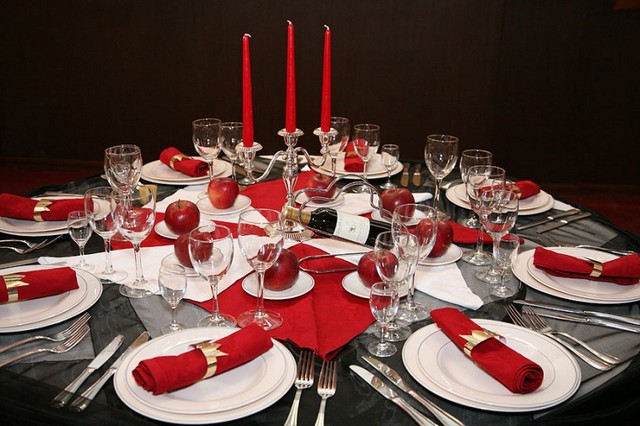
You are a GUI agent. You are given a task and a screenshot of the screen. Output one action in this format:
    pyautogui.click(x=<x>, y=<y>)
    Task: Click on the rolled napkins
    This screenshot has width=640, height=426.
    Given the screenshot: What is the action you would take?
    [x=226, y=351], [x=35, y=275], [x=54, y=209], [x=180, y=161], [x=351, y=159], [x=529, y=182], [x=557, y=268], [x=465, y=234], [x=496, y=360]